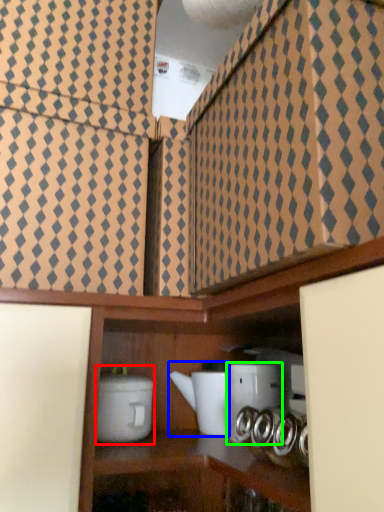
Question: Which object is positioned closest to appliance (highlighted by a red box)? Select from appliance (highlighted by a blue box) and appliance (highlighted by a green box).

Choices:
 (A) appliance
 (B) appliance

Answer: (A)